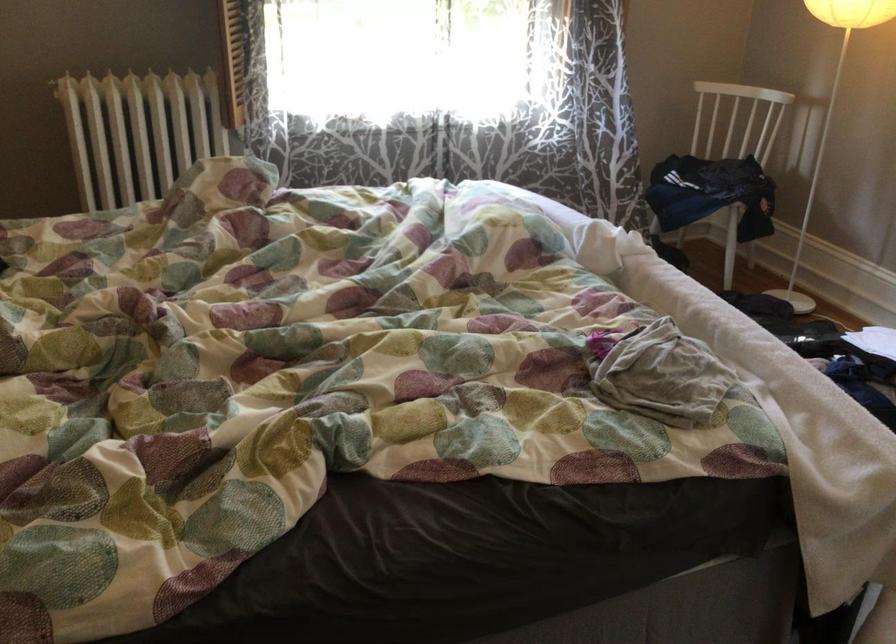
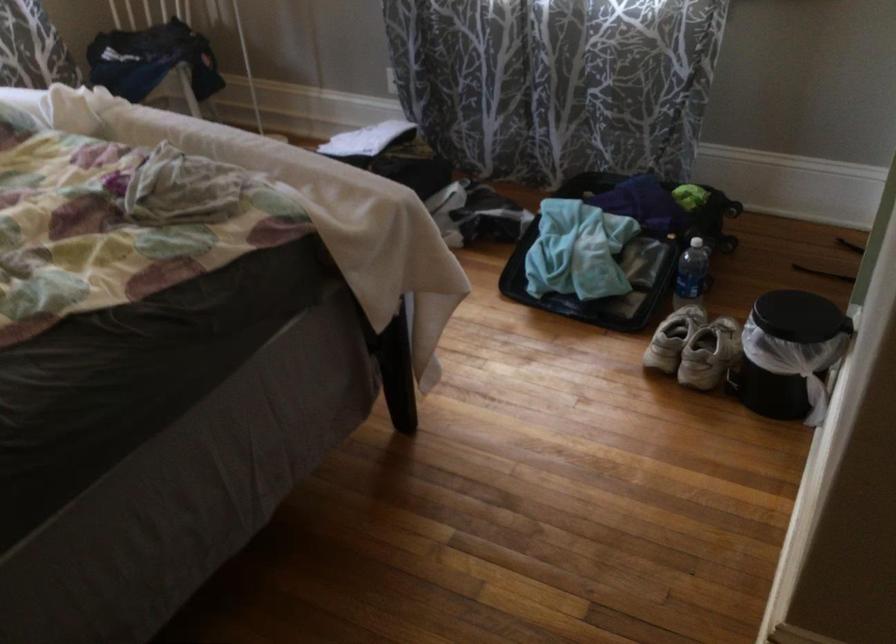
Question: The camera is either moving clockwise (left) or counter-clockwise (right) around the object. The first image is from the beginning of the video and the second image is from the end. Is the camera moving left or right when shooting the video?

Choices:
 (A) Left
 (B) Right

Answer: (A)